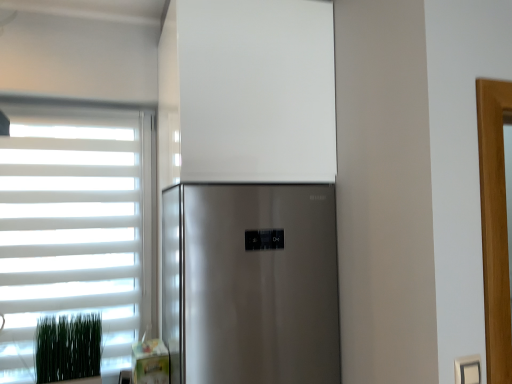
Question: Can you see white matte window at left touching green grass at lower left?

Choices:
 (A) no
 (B) yes

Answer: (A)

Question: Can you confirm if white matte window at left is positioned to the right of green grass at lower left?

Choices:
 (A) no
 (B) yes

Answer: (A)

Question: Is green grass at lower left inside white matte window at left?

Choices:
 (A) no
 (B) yes

Answer: (A)

Question: Can you confirm if white matte window at left is thinner than green grass at lower left?

Choices:
 (A) no
 (B) yes

Answer: (A)

Question: Can you confirm if white matte window at left is positioned to the left of green grass at lower left?

Choices:
 (A) yes
 (B) no

Answer: (A)

Question: From the image's perspective, is white matte window at left located beneath green grass at lower left?

Choices:
 (A) yes
 (B) no

Answer: (B)

Question: Is green grass at lower left facing away from white matte window at left?

Choices:
 (A) yes
 (B) no

Answer: (A)

Question: From the image's perspective, is green grass at lower left below white matte window at left?

Choices:
 (A) yes
 (B) no

Answer: (A)

Question: Is green grass at lower left shorter than white matte window at left?

Choices:
 (A) yes
 (B) no

Answer: (A)

Question: From a real-world perspective, is green grass at lower left under white matte window at left?

Choices:
 (A) no
 (B) yes

Answer: (B)

Question: Is green grass at lower left at the left side of white matte window at left?

Choices:
 (A) yes
 (B) no

Answer: (B)

Question: Is green grass at lower left smaller than white matte window at left?

Choices:
 (A) no
 (B) yes

Answer: (B)

Question: Can you confirm if white plastic electric outlet at lower right is taller than green grass at lower left?

Choices:
 (A) no
 (B) yes

Answer: (A)